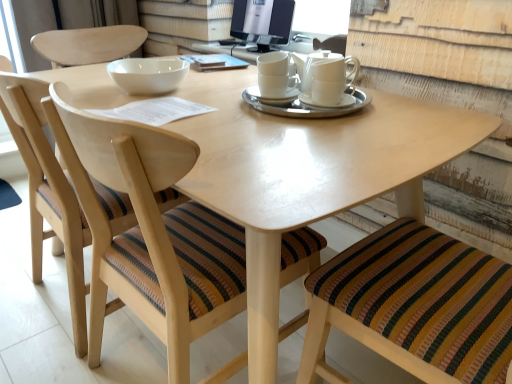
Question: From a real-world perspective, is white glossy bowl at upper center located beneath white ceramic saucer at center, the first saucer positioned from the right?

Choices:
 (A) yes
 (B) no

Answer: (B)

Question: Is white glossy bowl at upper center further to the viewer compared to white ceramic saucer at center, the 3th saucer from the left?

Choices:
 (A) yes
 (B) no

Answer: (A)

Question: Considering the relative positions of white glossy bowl at upper center and white ceramic saucer at center, the 3th saucer from the left, in the image provided, is white glossy bowl at upper center to the right of white ceramic saucer at center, the 3th saucer from the left, from the viewer's perspective?

Choices:
 (A) no
 (B) yes

Answer: (A)

Question: Is white glossy bowl at upper center not near white ceramic saucer at center, the 3th saucer from the left?

Choices:
 (A) no
 (B) yes

Answer: (A)

Question: Are white glossy bowl at upper center and white ceramic saucer at center, the first saucer positioned from the right, making contact?

Choices:
 (A) yes
 (B) no

Answer: (B)

Question: Is matte wood table at center to the left or to the right of striped fabric chair at lower right, the third chair positioned from the left, in the image?

Choices:
 (A) left
 (B) right

Answer: (A)

Question: Relative to striped fabric chair at lower right, the third chair positioned from the left, is matte wood table at center in front or behind?

Choices:
 (A) behind
 (B) front

Answer: (A)

Question: Considering the positions of matte wood table at center and striped fabric chair at lower right, positioned as the first chair in right-to-left order, in the image, is matte wood table at center taller or shorter than striped fabric chair at lower right, positioned as the first chair in right-to-left order,?

Choices:
 (A) tall
 (B) short

Answer: (B)

Question: In terms of width, does matte wood table at center look wider or thinner when compared to striped fabric chair at lower right, positioned as the first chair in right-to-left order?

Choices:
 (A) thin
 (B) wide

Answer: (B)

Question: From a real-world perspective, is white ceramic saucer at center, the 3th saucer from the left, above or below matte black monitor at upper center?

Choices:
 (A) above
 (B) below

Answer: (B)

Question: Is white ceramic saucer at center, the first saucer positioned from the right, in front of or behind matte black monitor at upper center in the image?

Choices:
 (A) behind
 (B) front

Answer: (B)

Question: Is white ceramic saucer at center, the 3th saucer from the left, to the left or to the right of matte black monitor at upper center in the image?

Choices:
 (A) left
 (B) right

Answer: (B)

Question: Considering the positions of point (352, 102) and point (265, 51), is point (352, 102) closer or farther from the camera than point (265, 51)?

Choices:
 (A) closer
 (B) farther

Answer: (A)

Question: From a real-world perspective, relative to wooden chair with striped cushion at lower left, the 1th chair in the left-to-right sequence, is white glossy bowl at upper center vertically above or below?

Choices:
 (A) above
 (B) below

Answer: (A)

Question: Would you say white glossy bowl at upper center is to the left or to the right of wooden chair with striped cushion at lower left, arranged as the 3th chair when viewed from the right, in the picture?

Choices:
 (A) left
 (B) right

Answer: (B)